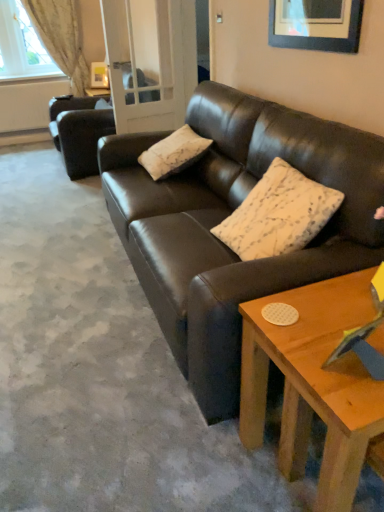
Question: From the image's perspective, relative to clear glass door at center, is light beige fabric curtain at upper left above or below?

Choices:
 (A) above
 (B) below

Answer: (A)

Question: Is light beige fabric curtain at upper left in front of or behind clear glass door at center in the image?

Choices:
 (A) front
 (B) behind

Answer: (B)

Question: Which object is the closest to the wooden coffee table at lower right?

Choices:
 (A) white textured curtain at upper left
 (B) white textured pillow at center, arranged as the second pillow when ordered from the bottom
 (C) white textured pillow at center, acting as the 2th pillow starting from the left
 (D) light beige fabric curtain at upper left
 (E) dark brown leather couch at upper left, which ranks as the second studio couch in front-to-back order

Answer: (C)

Question: Based on their relative distances, which object is farther from the white textured curtain at upper left?

Choices:
 (A) clear glass door at center
 (B) dark brown leather couch at upper left, acting as the 2th studio couch starting from the right
 (C) white textured pillow at center, placed as the first pillow when sorted from left to right
 (D) white textured pillow at center, positioned as the first pillow in right-to-left order
 (E) wooden coffee table at lower right

Answer: (E)